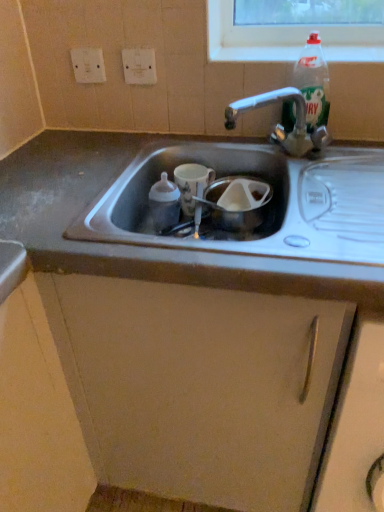
What do you see at coordinates (88, 65) in the screenshot? I see `white plastic electric outlet at upper left, placed as the 1th electric outlet when sorted from left to right` at bounding box center [88, 65].

At what (x,y) coordinates should I click in order to perform the action: click on clear glass bottle at upper center. Please return your answer as a coordinate pair (x, y). This screenshot has width=384, height=512. Looking at the image, I should click on (254, 53).

What do you see at coordinates (254, 53) in the screenshot? I see `clear glass bottle at upper center` at bounding box center [254, 53].

What do you see at coordinates (164, 203) in the screenshot? This screenshot has height=512, width=384. I see `matte plastic bottle at sink center, the second bottle when ordered from right to left` at bounding box center [164, 203].

You are a GUI agent. You are given a task and a screenshot of the screen. Output one action in this format:
    pyautogui.click(x=<x>, y=<y>)
    Task: Click on the white plastic electric outlet at upper center, the second electric outlet viewed from the left
    
    Given the screenshot: What is the action you would take?
    pyautogui.click(x=139, y=66)

What are the coordinates of `metallic gray cabinet at center` in the screenshot? It's located at (199, 386).

This screenshot has height=512, width=384. I want to click on white glossy cup at center, so pyautogui.click(x=191, y=183).

I want to click on white plastic electric outlet at upper left, placed as the 1th electric outlet when sorted from left to right, so click(88, 65).

Is clear glass bottle at upper center to the right of white glossy cup at center from the viewer's perspective?

Yes, clear glass bottle at upper center is to the right of white glossy cup at center.

From the image's perspective, is clear glass bottle at upper center under white glossy cup at center?

No, from the image's perspective, clear glass bottle at upper center is not below white glossy cup at center.

Who is smaller, clear glass bottle at upper center or white glossy cup at center?

clear glass bottle at upper center is smaller.

Is clear glass bottle at upper center aimed at white glossy cup at center?

No, clear glass bottle at upper center does not turn towards white glossy cup at center.

From the image's perspective, is clear plastic bottle at upper right, which is counted as the first bottle, starting from the top, located above or below white plastic electric outlet at upper center, which is counted as the 1th electric outlet, starting from the right?

From the image's perspective, clear plastic bottle at upper right, which is counted as the first bottle, starting from the top, appears below white plastic electric outlet at upper center, which is counted as the 1th electric outlet, starting from the right.

Considering their positions, is clear plastic bottle at upper right, which is counted as the first bottle, starting from the top, located in front of or behind white plastic electric outlet at upper center, the second electric outlet viewed from the left?

Clearly, clear plastic bottle at upper right, which is counted as the first bottle, starting from the top, is in front of white plastic electric outlet at upper center, the second electric outlet viewed from the left.

Is clear plastic bottle at upper right, which ranks as the second bottle in bottom-to-top order, positioned beyond the bounds of white plastic electric outlet at upper center, the second electric outlet viewed from the left?

clear plastic bottle at upper right, which ranks as the second bottle in bottom-to-top order, lies outside white plastic electric outlet at upper center, the second electric outlet viewed from the left,'s area.

Considering the sizes of clear plastic bottle at upper right, which ranks as the second bottle in bottom-to-top order, and white plastic electric outlet at upper center, which is counted as the 1th electric outlet, starting from the right, in the image, is clear plastic bottle at upper right, which ranks as the second bottle in bottom-to-top order, wider or thinner than white plastic electric outlet at upper center, which is counted as the 1th electric outlet, starting from the right,?

Clearly, clear plastic bottle at upper right, which ranks as the second bottle in bottom-to-top order, has more width compared to white plastic electric outlet at upper center, which is counted as the 1th electric outlet, starting from the right.

From a real-world perspective, which is physically above, white plastic electric outlet at upper center, which is counted as the 1th electric outlet, starting from the right, or metallic gray cabinet at center?

white plastic electric outlet at upper center, which is counted as the 1th electric outlet, starting from the right, is physically above.

Is white plastic electric outlet at upper center, which is counted as the 1th electric outlet, starting from the right, shorter than metallic gray cabinet at center?

Indeed, white plastic electric outlet at upper center, which is counted as the 1th electric outlet, starting from the right, has a lesser height compared to metallic gray cabinet at center.

Can you tell me how much white plastic electric outlet at upper center, the second electric outlet viewed from the left, and metallic gray cabinet at center differ in facing direction?

1.02 degrees separate the facing orientations of white plastic electric outlet at upper center, the second electric outlet viewed from the left, and metallic gray cabinet at center.

What's the angular difference between white glossy cup at center and clear plastic bottle at upper right, which ranks as the second bottle in bottom-to-top order,'s facing directions?

They differ by 0.149 degrees in their facing directions.

Find the location of a particular element. This screenshot has width=384, height=512. bottle on the right of white glossy cup at center is located at coordinates (313, 82).

Does white glossy cup at center contain clear plastic bottle at upper right, marked as the 2th bottle in a left-to-right arrangement?

Definitely not — clear plastic bottle at upper right, marked as the 2th bottle in a left-to-right arrangement, is not inside white glossy cup at center.

In terms of size, does white glossy cup at center appear bigger or smaller than clear plastic bottle at upper right, which is counted as the first bottle, starting from the top?

Clearly, white glossy cup at center is smaller in size than clear plastic bottle at upper right, which is counted as the first bottle, starting from the top.

Is metallic gray cabinet at center shorter than white plastic electric outlet at upper center, the second electric outlet viewed from the left?

No, metallic gray cabinet at center is not shorter than white plastic electric outlet at upper center, the second electric outlet viewed from the left.

Image resolution: width=384 pixels, height=512 pixels. Find the location of `electric outlet that appears on the right of metallic gray cabinet at center`. electric outlet that appears on the right of metallic gray cabinet at center is located at coordinates (139, 66).

Is metallic gray cabinet at center to the right of white plastic electric outlet at upper center, which is counted as the 1th electric outlet, starting from the right, from the viewer's perspective?

In fact, metallic gray cabinet at center is to the left of white plastic electric outlet at upper center, which is counted as the 1th electric outlet, starting from the right.

How many degrees apart are the facing directions of metallic gray cabinet at center and white plastic electric outlet at upper center, the second electric outlet viewed from the left?

The facing directions of metallic gray cabinet at center and white plastic electric outlet at upper center, the second electric outlet viewed from the left, are 1.02 degrees apart.

From a real-world perspective, which is physically below, matte plastic bottle at sink center, the first bottle positioned from the bottom, or clear glass bottle at upper center?

matte plastic bottle at sink center, the first bottle positioned from the bottom, from a real-world perspective.

Are matte plastic bottle at sink center, the second bottle when ordered from right to left, and clear glass bottle at upper center beside each other?

matte plastic bottle at sink center, the second bottle when ordered from right to left, and clear glass bottle at upper center are not in contact.

How much distance is there between matte plastic bottle at sink center, the second bottle when ordered from right to left, and clear glass bottle at upper center?

17.44 inches.

Is metallic gray cabinet at center not close to clear plastic bottle at upper right, which appears as the 1th bottle when viewed from the right?

metallic gray cabinet at center is near clear plastic bottle at upper right, which appears as the 1th bottle when viewed from the right, not far away.

Looking at this image, can you confirm if metallic gray cabinet at center is positioned to the right of clear plastic bottle at upper right, which appears as the 1th bottle when viewed from the right?

No, metallic gray cabinet at center is not to the right of clear plastic bottle at upper right, which appears as the 1th bottle when viewed from the right.

Does point (92, 371) appear closer or farther from the camera than point (313, 67)?

Point (92, 371) is positioned closer to the camera compared to point (313, 67).

Is metallic gray cabinet at center inside the boundaries of clear plastic bottle at upper right, marked as the 2th bottle in a left-to-right arrangement, or outside?

metallic gray cabinet at center exists outside the volume of clear plastic bottle at upper right, marked as the 2th bottle in a left-to-right arrangement.

The width and height of the screenshot is (384, 512). In order to click on cup directly beneath the clear glass bottle at upper center (from a real-world perspective) in this screenshot , I will do click(x=191, y=183).

I want to click on bottle that is the 2nd object located in front of the white plastic electric outlet at upper center, which is counted as the 1th electric outlet, starting from the right, so click(x=313, y=82).

From the image, which object appears to be nearer to clear glass bottle at upper center, white glossy cup at center or white plastic electric outlet at upper center, the second electric outlet viewed from the left?

The object closer to clear glass bottle at upper center is white plastic electric outlet at upper center, the second electric outlet viewed from the left.

Based on their spatial positions, is white plastic electric outlet at upper center, the second electric outlet viewed from the left, or clear glass bottle at upper center closer to clear plastic bottle at upper right, which appears as the 1th bottle when viewed from the right?

clear glass bottle at upper center lies closer to clear plastic bottle at upper right, which appears as the 1th bottle when viewed from the right, than the other object.

When comparing their distances from white plastic electric outlet at upper center, which is counted as the 1th electric outlet, starting from the right, does white plastic electric outlet at upper left, placed as the 1th electric outlet when sorted from left to right, or matte plastic bottle at sink center, the first bottle positioned from the bottom, seem closer?

The object closer to white plastic electric outlet at upper center, which is counted as the 1th electric outlet, starting from the right, is white plastic electric outlet at upper left, placed as the 1th electric outlet when sorted from left to right.

Considering their positions, is white plastic electric outlet at upper left, placed as the 1th electric outlet when sorted from left to right, positioned further to clear plastic bottle at upper right, which appears as the 1th bottle when viewed from the right, than white plastic electric outlet at upper center, which is counted as the 1th electric outlet, starting from the right?

white plastic electric outlet at upper left, placed as the 1th electric outlet when sorted from left to right, is positioned further to the anchor clear plastic bottle at upper right, which appears as the 1th bottle when viewed from the right.

From the image, which object appears to be nearer to clear glass bottle at upper center, white plastic electric outlet at upper left, placed as the 1th electric outlet when sorted from left to right, or clear plastic bottle at upper right, which appears as the 1th bottle when viewed from the right?

clear plastic bottle at upper right, which appears as the 1th bottle when viewed from the right.

Based on the photo, considering their positions, is matte plastic bottle at sink center, acting as the 1th bottle starting from the left, positioned further to metallic gray cabinet at center than clear glass bottle at upper center?

clear glass bottle at upper center is further to metallic gray cabinet at center.

When comparing their distances from white plastic electric outlet at upper left, the 2th electric outlet positioned from the right, does clear plastic bottle at upper right, marked as the 2th bottle in a left-to-right arrangement, or matte plastic bottle at sink center, which appears as the 2th bottle when viewed from the top, seem further?

clear plastic bottle at upper right, marked as the 2th bottle in a left-to-right arrangement, is further to white plastic electric outlet at upper left, the 2th electric outlet positioned from the right.

Which object lies nearer to the anchor point metallic gray cabinet at center, clear glass bottle at upper center or white plastic electric outlet at upper center, which is counted as the 1th electric outlet, starting from the right?

Based on the image, clear glass bottle at upper center appears to be nearer to metallic gray cabinet at center.

Locate an element on the screen. window sill situated between white plastic electric outlet at upper center, the second electric outlet viewed from the left, and clear plastic bottle at upper right, which appears as the 1th bottle when viewed from the right, from left to right is located at coordinates (254, 53).

This screenshot has height=512, width=384. In order to click on bottle between white plastic electric outlet at upper left, the 2th electric outlet positioned from the right, and clear glass bottle at upper center in this screenshot , I will do `click(164, 203)`.

This screenshot has width=384, height=512. Identify the location of electric outlet between white plastic electric outlet at upper left, placed as the 1th electric outlet when sorted from left to right, and metallic gray cabinet at center vertically. (139, 66).

Locate an element on the screen. The width and height of the screenshot is (384, 512). bottle between white plastic electric outlet at upper center, which is counted as the 1th electric outlet, starting from the right, and clear glass bottle at upper center, in the horizontal direction is located at coordinates (164, 203).